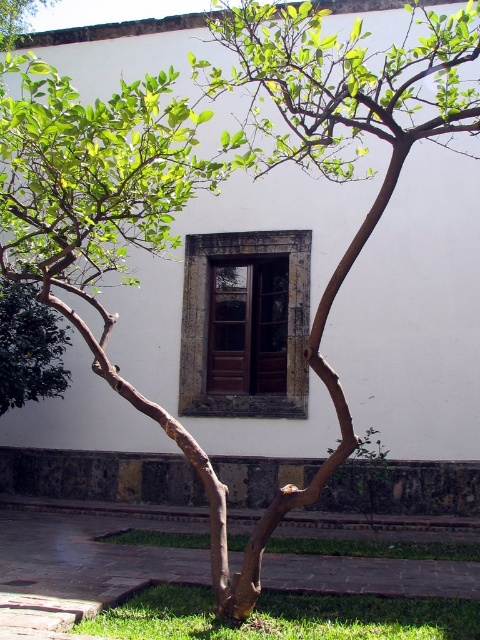
Where is the brown wooden window at center located in the image?

The brown wooden window at center is located at point coordinates of (x=244, y=324).

In the scene shown: You are standing in front of the white wall with the window and door. You want to plant a new tree in the exact spot where the green leafy tree at lower left is currently growing. What are the coordinates of the location where you should plant the new tree?

The coordinates for the location where the green leafy tree at lower left is situated are exactly at point (29,348). Therefore, you should plant the new tree at those coordinates.